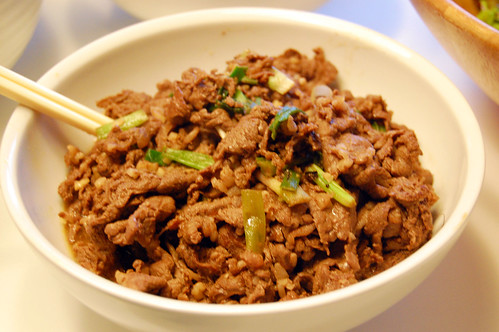
Find the location of a particular element. white bowls is located at coordinates (8, 22), (144, 9).